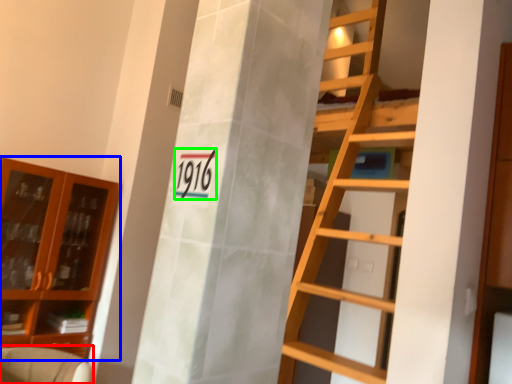
Question: Estimate the real-world distances between objects in this image. Which object is farther from armchair (highlighted by a red box), cabinetry (highlighted by a blue box) or number (highlighted by a green box)?

Choices:
 (A) cabinetry
 (B) number

Answer: (B)